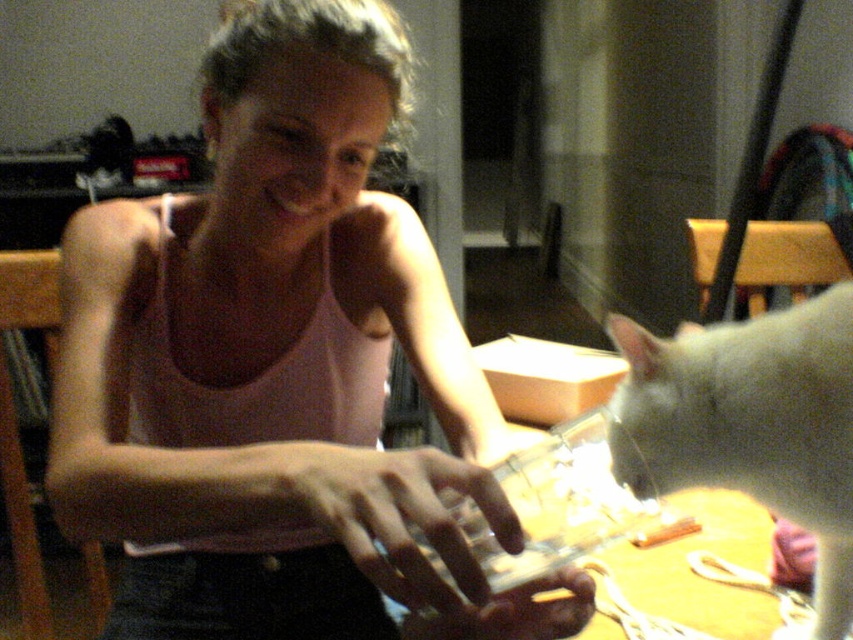
Who is taller, pink matte tank top at center or yellow wood table at center?

Standing taller between the two is pink matte tank top at center.

Can you confirm if pink matte tank top at center is positioned to the right of yellow wood table at center?

Incorrect, pink matte tank top at center is not on the right side of yellow wood table at center.

Is point (225, 26) positioned in front of point (543, 564)?

No, (225, 26) is behind (543, 564).

Identify the location of pink matte tank top at center. The height and width of the screenshot is (640, 853). (277, 364).

Can you confirm if white fur cat at lower right is wider than yellow wood table at center?

No, white fur cat at lower right is not wider than yellow wood table at center.

Is white fur cat at lower right behind yellow wood table at center?

Yes, white fur cat at lower right is further from the viewer.

Where is `white fur cat at lower right`? The width and height of the screenshot is (853, 640). white fur cat at lower right is located at coordinates (750, 426).

Does pink matte tank top at center have a larger size compared to white fur cat at lower right?

Correct, pink matte tank top at center is larger in size than white fur cat at lower right.

Measure the distance between point (380, 579) and camera.

Point (380, 579) is 19.63 inches away from camera.

The width and height of the screenshot is (853, 640). What do you see at coordinates (277, 364) in the screenshot?
I see `pink matte tank top at center` at bounding box center [277, 364].

This screenshot has width=853, height=640. I want to click on pink matte tank top at center, so click(x=277, y=364).